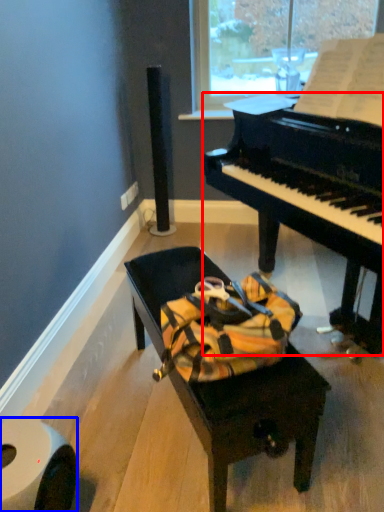
Question: Which object is further to the camera taking this photo, piano (highlighted by a red box) or toilet paper (highlighted by a blue box)?

Choices:
 (A) piano
 (B) toilet paper

Answer: (B)